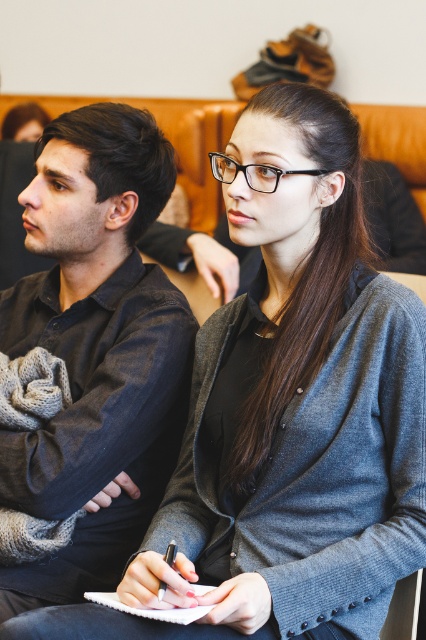
Can you confirm if denim shirt at left is thinner than metallic pen at center?

No.

Is point (49, 337) in front of point (172, 560)?

No, it is not.

Measure the distance between denim shirt at left and camera.

denim shirt at left is 3.99 feet away from camera.

Locate an element on the screen. The height and width of the screenshot is (640, 426). denim shirt at left is located at coordinates 95,348.

Which is more to the right, white paper notebook at center or metallic pen at center?

metallic pen at center

Can you confirm if white paper notebook at center is wider than metallic pen at center?

Yes, white paper notebook at center is wider than metallic pen at center.

Describe the element at coordinates (149, 609) in the screenshot. I see `white paper notebook at center` at that location.

The image size is (426, 640). I want to click on white paper notebook at center, so click(x=149, y=609).

Based on the photo, does denim shirt at left have a greater width compared to white paper notebook at center?

Yes, denim shirt at left is wider than white paper notebook at center.

Between denim shirt at left and white paper notebook at center, which one is positioned lower?

Positioned lower is white paper notebook at center.

Locate an element on the screen. Image resolution: width=426 pixels, height=640 pixels. denim shirt at left is located at coordinates (95, 348).

In order to click on denim shirt at left in this screenshot , I will do `click(95, 348)`.